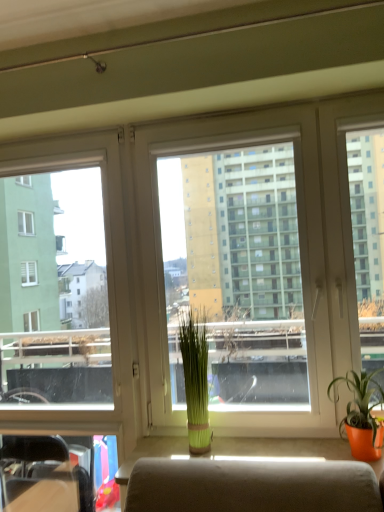
In order to click on empty space that is ontop of transparent glass window at left (from a real-world perspective) in this screenshot , I will do `click(49, 137)`.